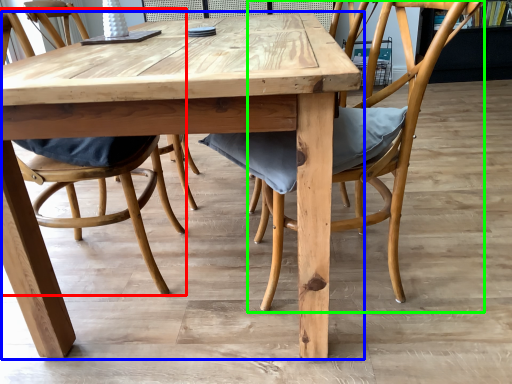
Question: Considering the real-world distances, which object is farthest from chair (highlighted by a red box)? kitchen & dining room table (highlighted by a blue box) or chair (highlighted by a green box)?

Choices:
 (A) kitchen & dining room table
 (B) chair

Answer: (B)